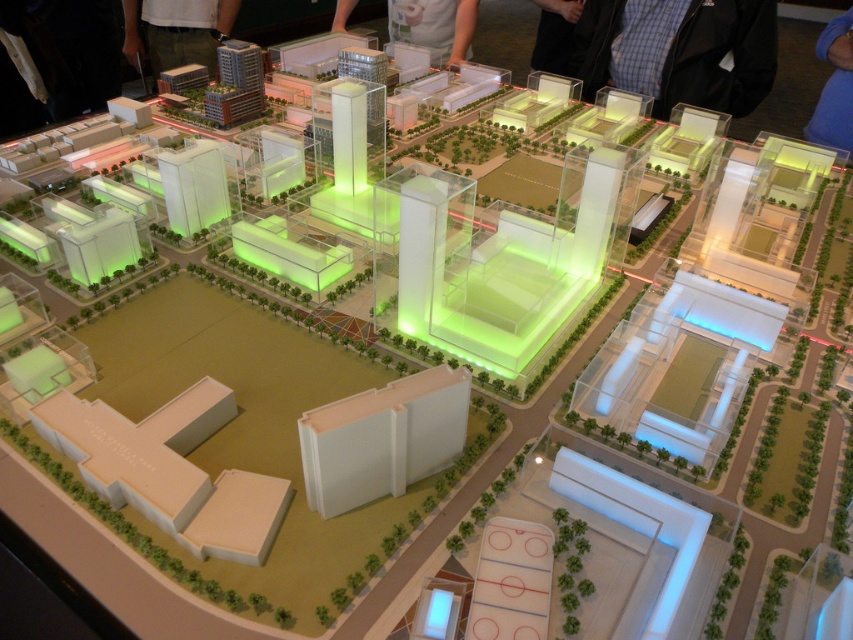
You are an urban planner examining the architectural model. You notice the matte white shirt at upper center and the blue fabric at upper right. Which object has a greater width in the model?

The matte white shirt at upper center has a greater width than the blue fabric at upper right.

You are an urban planner reviewing the architectural model. You notice the matte white shirt at upper center and the blue fabric at upper right in the model. Which object takes up more space in the model?

The matte white shirt at upper center has a larger size compared to the blue fabric at upper right, so it takes up more space in the model.

You are a city planner reviewing the architectural model. You notice a point marked at coordinates (434, 26). What does this point indicate in the model?

The point at coordinates (434, 26) marks the matte white shirt at upper center in the model.